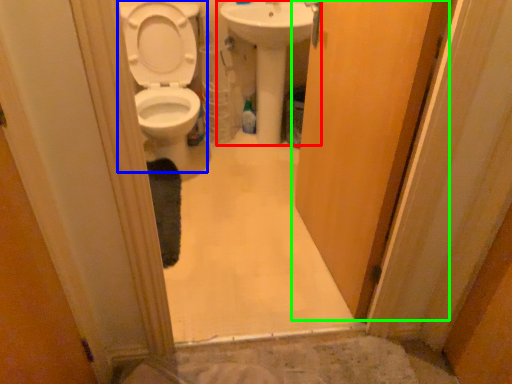
Question: Which is farther away from sink (highlighted by a red box)? toilet (highlighted by a blue box) or door (highlighted by a green box)?

Choices:
 (A) toilet
 (B) door

Answer: (B)